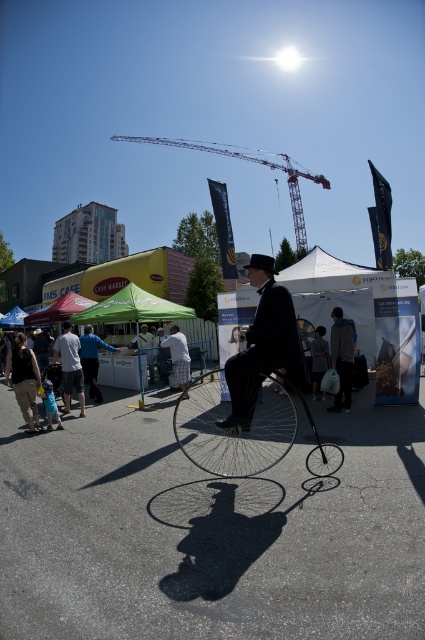
You are a photographer trying to capture the scene. You notice the matte black suit at center and the green fabric canopy at center. Which object would appear narrower in your photo?

The matte black suit at center is thinner than the green fabric canopy at center, so it would appear narrower in the photo.

You are standing at the point marked as point [263,344] in the image. What object are you directly facing?

The point [263,344] corresponds to the matte black suit at center, so you are directly facing the matte black suit at center.